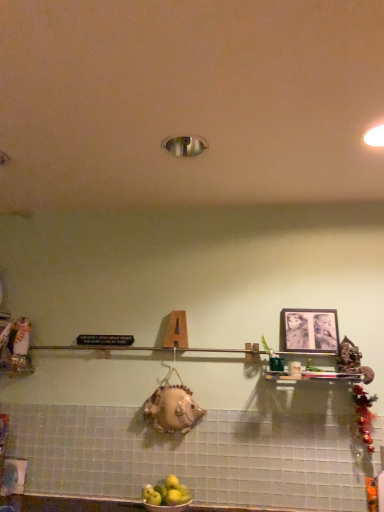
Question: From the image's perspective, would you say black matte picture frame at upper right is positioned over yellow matte apples at lower center?

Choices:
 (A) yes
 (B) no

Answer: (A)

Question: Does black matte picture frame at upper right turn towards yellow matte apples at lower center?

Choices:
 (A) yes
 (B) no

Answer: (B)

Question: From a real-world perspective, is black matte picture frame at upper right below yellow matte apples at lower center?

Choices:
 (A) yes
 (B) no

Answer: (B)

Question: Is black matte picture frame at upper right to the left of yellow matte apples at lower center from the viewer's perspective?

Choices:
 (A) no
 (B) yes

Answer: (A)

Question: From the image's perspective, is black matte picture frame at upper right below yellow matte apples at lower center?

Choices:
 (A) yes
 (B) no

Answer: (B)

Question: Is black matte picture frame at upper right turned away from yellow matte apples at lower center?

Choices:
 (A) no
 (B) yes

Answer: (A)

Question: From the image's perspective, is yellow matte apples at lower center on black matte picture frame at upper right?

Choices:
 (A) yes
 (B) no

Answer: (B)

Question: Does yellow matte apples at lower center lie in front of black matte picture frame at upper right?

Choices:
 (A) yes
 (B) no

Answer: (A)

Question: From the image's perspective, is yellow matte apples at lower center below black matte picture frame at upper right?

Choices:
 (A) yes
 (B) no

Answer: (A)

Question: Does yellow matte apples at lower center have a greater width compared to black matte picture frame at upper right?

Choices:
 (A) no
 (B) yes

Answer: (B)

Question: Can we say yellow matte apples at lower center lies outside black matte picture frame at upper right?

Choices:
 (A) yes
 (B) no

Answer: (A)

Question: Is yellow matte apples at lower center positioned behind black matte picture frame at upper right?

Choices:
 (A) yes
 (B) no

Answer: (B)

Question: Is yellow matte apples at lower center inside or outside of black matte picture frame at upper right?

Choices:
 (A) inside
 (B) outside

Answer: (B)